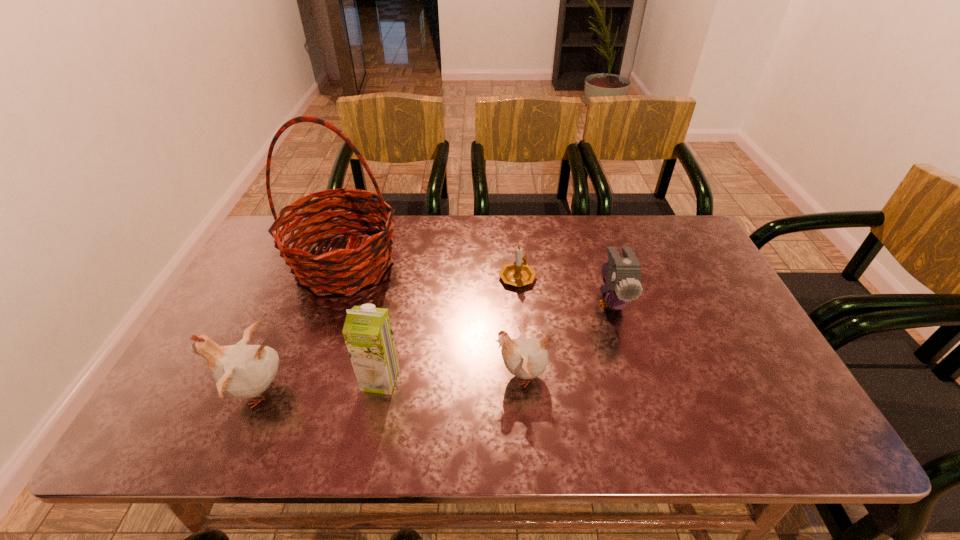
Find the location of `unoccupied area between the second bird from left to right and the candle holder`. unoccupied area between the second bird from left to right and the candle holder is located at coordinates (519, 326).

Locate an element on the screen. This screenshot has width=960, height=540. vacant region between the second bird from left to right and the fifth shortest object is located at coordinates (451, 377).

Where is `empty space between the farthest bird and the tallest object`? Image resolution: width=960 pixels, height=540 pixels. empty space between the farthest bird and the tallest object is located at coordinates (478, 282).

Where is `vacant area that lies between the soya milk and the leftmost bird`? The image size is (960, 540). vacant area that lies between the soya milk and the leftmost bird is located at coordinates (319, 385).

The image size is (960, 540). Find the location of `free spot between the soya milk and the candle holder`. free spot between the soya milk and the candle holder is located at coordinates (449, 328).

You are a GUI agent. You are given a task and a screenshot of the screen. Output one action in this format:
    pyautogui.click(x=<x>, y=<y>)
    Task: Click on the second closest object to the soya milk
    Image resolution: width=960 pixels, height=540 pixels.
    Given the screenshot: What is the action you would take?
    pyautogui.click(x=363, y=263)

Select which object is the fourth closest to the fifth shortest object. Please provide its 2D coordinates. Your answer should be formatted as a tuple, i.e. [(x, y)], where the tuple contains the x and y coordinates of a point satisfying the conditions above.

[(519, 273)]

Where is `bird identified as the third closest to the basket`? This screenshot has height=540, width=960. bird identified as the third closest to the basket is located at coordinates (623, 275).

The width and height of the screenshot is (960, 540). What are the coordinates of `the second closest bird relative to the basket` in the screenshot? It's located at (525, 358).

The height and width of the screenshot is (540, 960). What are the coordinates of `free spot that satisfies the following two spatial constraints: 1. at the beak of the farthest bird; 2. at the beak of the second bird from left to right` in the screenshot? It's located at (635, 375).